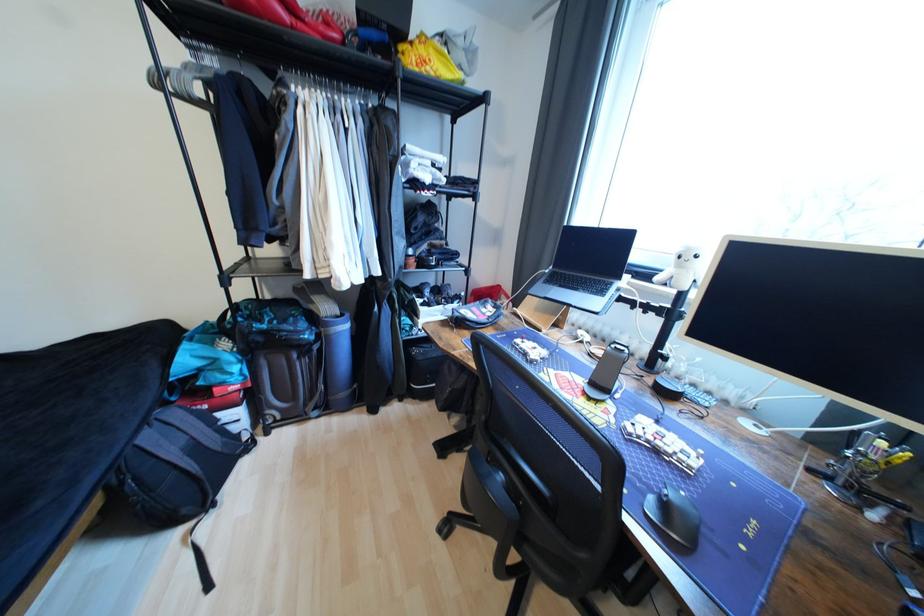
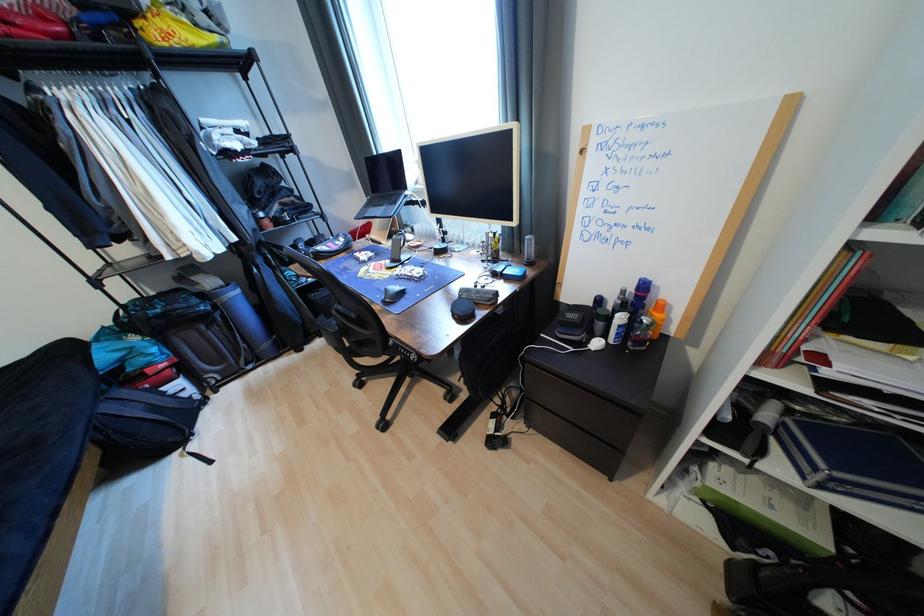
Where in the second image is the point corresponding to the point at 155,439 from the first image?

(116, 408)